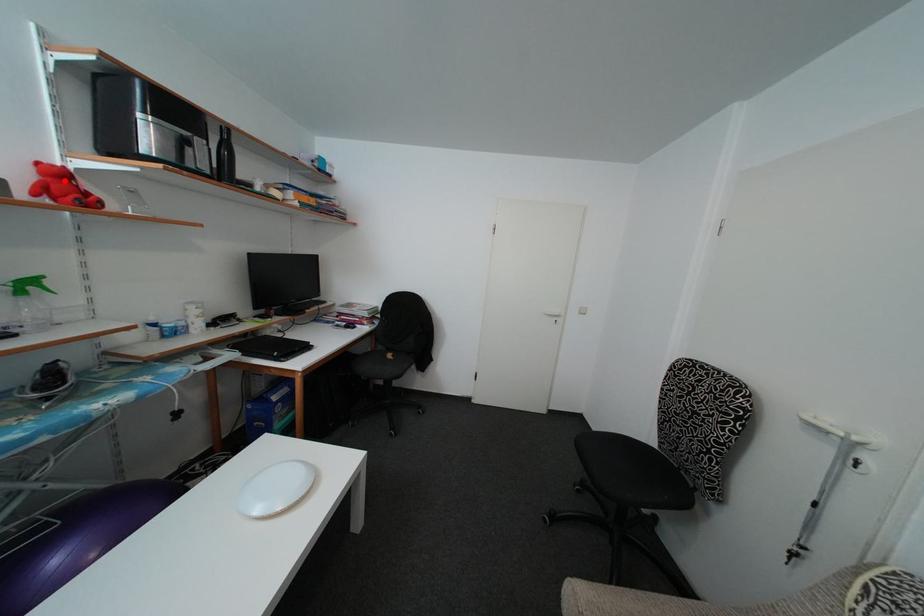
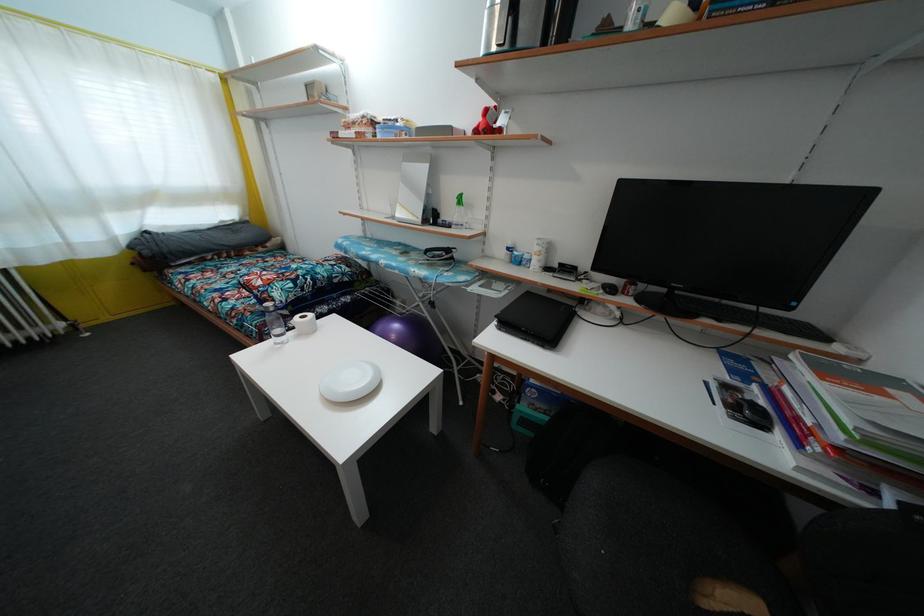
The point at the highlighted location is marked in the first image. Where is the corresponding point in the second image?

(490, 119)